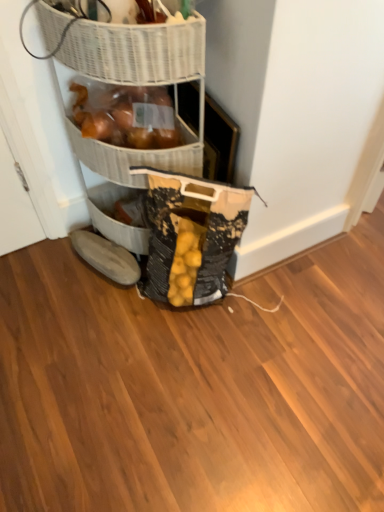
Question: From a real-world perspective, is textured canvas bag at lower center physically located above or below white wicker basket at upper left, marked as the first basket in a front-to-back arrangement?

Choices:
 (A) above
 (B) below

Answer: (B)

Question: Relative to white wicker basket at upper left, which is counted as the second basket, starting from the back, is textured canvas bag at lower center in front or behind?

Choices:
 (A) front
 (B) behind

Answer: (B)

Question: Estimate the real-world distances between objects in this image. Which object is closer to the textured canvas bag at lower center?

Choices:
 (A) white wicker basket at upper left, marked as the first basket in a front-to-back arrangement
 (B) brown suede boot at lower left
 (C) woven brown basket at upper center, acting as the first basket starting from the back

Answer: (C)

Question: Estimate the real-world distances between objects in this image. Which object is closer to the textured canvas bag at lower center?

Choices:
 (A) woven brown basket at upper center, acting as the first basket starting from the back
 (B) brown suede boot at lower left
 (C) white wicker basket at upper left, marked as the first basket in a front-to-back arrangement

Answer: (A)